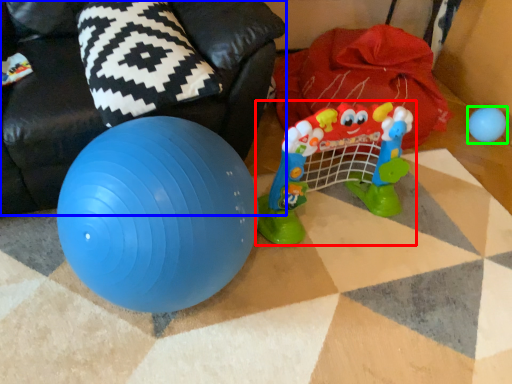
Question: Estimate the real-world distances between objects in this image. Which object is farther from toy (highlighted by a red box), bean bag chair (highlighted by a blue box) or toy (highlighted by a green box)?

Choices:
 (A) bean bag chair
 (B) toy

Answer: (B)